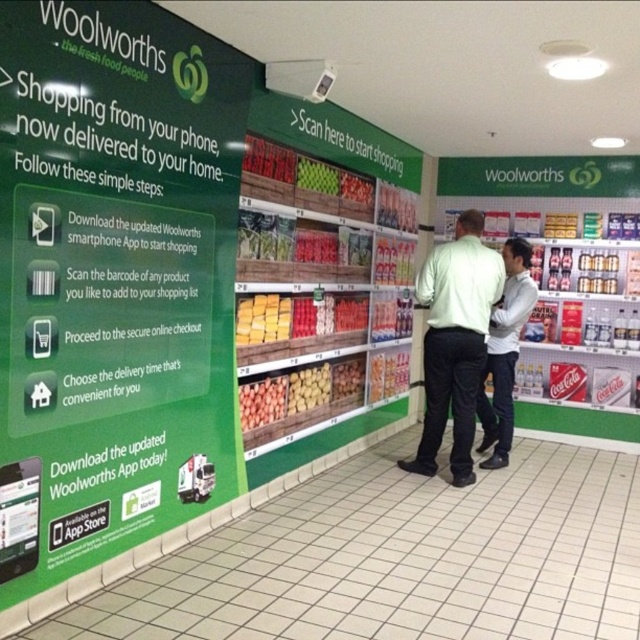
Based on the scene description, where is the light green shirt at center located in relation to the large green wall on the left side of the image?

→ The light green shirt at center is located at point coordinates of (454, 342).

You are a customer in the Woolworths store and you see two shirts displayed at the center of the promotional area. The light green shirt at center and the white shirt at center. Which one is taller?

The light green shirt at center is much taller than the white shirt at center.